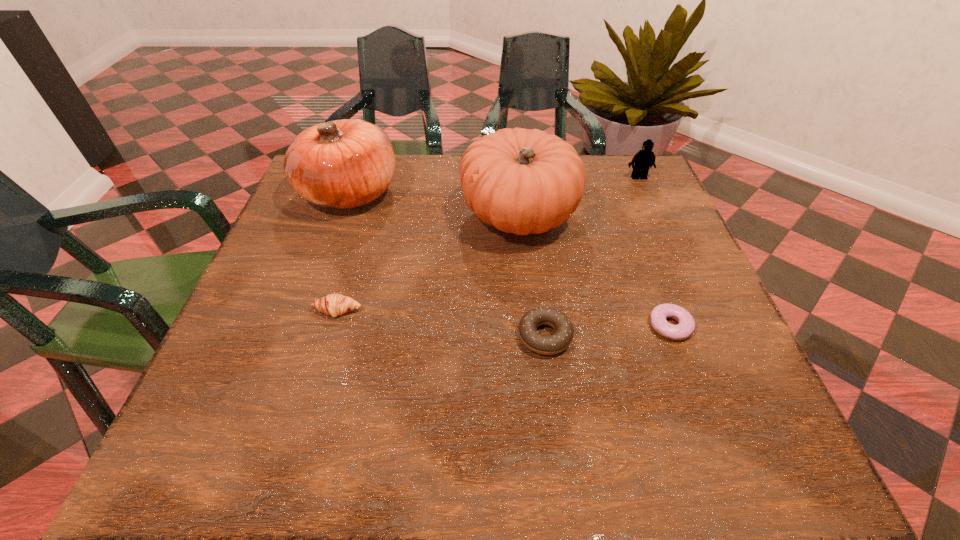
Locate an element on the screen. This screenshot has height=540, width=960. vacant space at the near edge of the desktop is located at coordinates (425, 450).

Find the location of a particular element. blank space at the left edge of the desktop is located at coordinates (282, 354).

Image resolution: width=960 pixels, height=540 pixels. In the image, there is a desktop. Find the location of `vacant space at the right edge`. vacant space at the right edge is located at coordinates 670,298.

Locate an element on the screen. The height and width of the screenshot is (540, 960). vacant space at the near left corner is located at coordinates [189, 462].

You are a GUI agent. You are given a task and a screenshot of the screen. Output one action in this format:
    pyautogui.click(x=<x>, y=<y>)
    Task: Click on the free space at the far right corner of the desktop
    Image resolution: width=960 pixels, height=540 pixels.
    Given the screenshot: What is the action you would take?
    pyautogui.click(x=627, y=197)

Identify the location of unoccupied position between the shortest object and the left doughnut. (608, 331).

Where is `vacant space that's between the fourth shortest object and the left doughnut`? vacant space that's between the fourth shortest object and the left doughnut is located at coordinates (591, 256).

You are a GUI agent. You are given a task and a screenshot of the screen. Output one action in this format:
    pyautogui.click(x=<x>, y=<y>)
    Task: Click on the free point between the shorter doughnut and the left doughnut
    The image size is (960, 540).
    Given the screenshot: What is the action you would take?
    pyautogui.click(x=608, y=331)

I want to click on free space between the pastry and the right pumpkin, so click(x=428, y=262).

I want to click on empty space between the right pumpkin and the left pumpkin, so click(x=434, y=204).